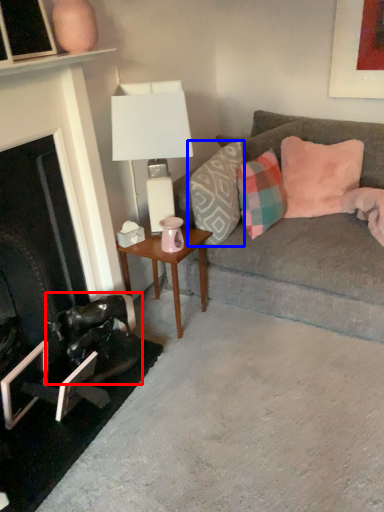
Question: Which object is closer to the camera taking this photo, swivel chair (highlighted by a red box) or pillow (highlighted by a blue box)?

Choices:
 (A) swivel chair
 (B) pillow

Answer: (A)